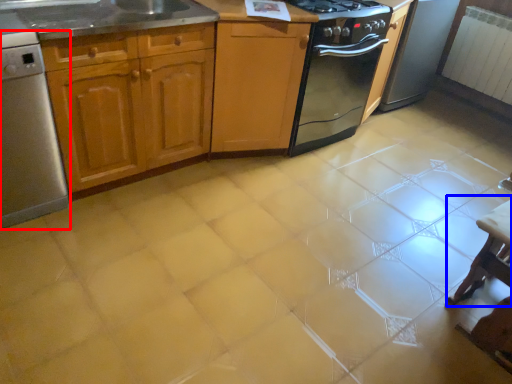
Question: Which of the following is the closest to the observer, home appliance (highlighted by a red box) or table (highlighted by a blue box)?

Choices:
 (A) home appliance
 (B) table

Answer: (A)